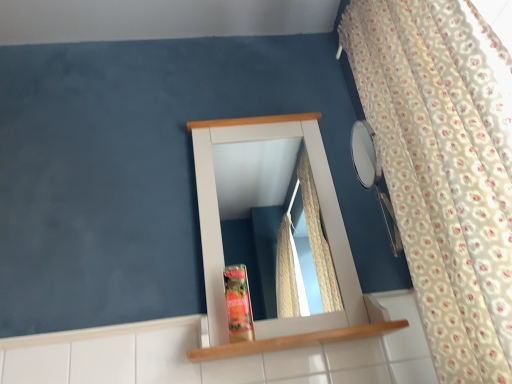
Question: Is wooden shelf at center beside white floral fabric curtain at right?

Choices:
 (A) yes
 (B) no

Answer: (B)

Question: From the image's perspective, does wooden shelf at center appear lower than white floral fabric curtain at right?

Choices:
 (A) yes
 (B) no

Answer: (A)

Question: Considering the relative sizes of wooden shelf at center and white floral fabric curtain at right in the image provided, is wooden shelf at center wider than white floral fabric curtain at right?

Choices:
 (A) yes
 (B) no

Answer: (B)

Question: Considering the relative sizes of wooden shelf at center and white floral fabric curtain at right in the image provided, is wooden shelf at center shorter than white floral fabric curtain at right?

Choices:
 (A) no
 (B) yes

Answer: (B)

Question: Can you confirm if wooden shelf at center is taller than white floral fabric curtain at right?

Choices:
 (A) yes
 (B) no

Answer: (B)

Question: Is point (437, 6) closer or farther from the camera than point (297, 334)?

Choices:
 (A) closer
 (B) farther

Answer: (A)

Question: From the image's perspective, is white floral fabric curtain at right above or below wooden shelf at center?

Choices:
 (A) above
 (B) below

Answer: (A)

Question: Is white floral fabric curtain at right situated inside wooden shelf at center or outside?

Choices:
 (A) outside
 (B) inside

Answer: (A)

Question: Considering the positions of white floral fabric curtain at right and wooden shelf at center in the image, is white floral fabric curtain at right wider or thinner than wooden shelf at center?

Choices:
 (A) wide
 (B) thin

Answer: (A)

Question: Visually, is matte plastic toiletry at center positioned to the left or to the right of white glossy mirror at center?

Choices:
 (A) right
 (B) left

Answer: (A)

Question: Is point (237, 332) closer or farther from the camera than point (159, 231)?

Choices:
 (A) farther
 (B) closer

Answer: (B)

Question: From the image's perspective, is matte plastic toiletry at center located above or below white glossy mirror at center?

Choices:
 (A) below
 (B) above

Answer: (A)

Question: Considering the positions of matte plastic toiletry at center and white glossy mirror at center in the image, is matte plastic toiletry at center taller or shorter than white glossy mirror at center?

Choices:
 (A) short
 (B) tall

Answer: (A)

Question: Relative to wooden shelf at center, is matte plastic toiletry at center in front or behind?

Choices:
 (A) front
 (B) behind

Answer: (B)

Question: Is point (239, 286) positioned closer to the camera than point (367, 334)?

Choices:
 (A) farther
 (B) closer

Answer: (A)